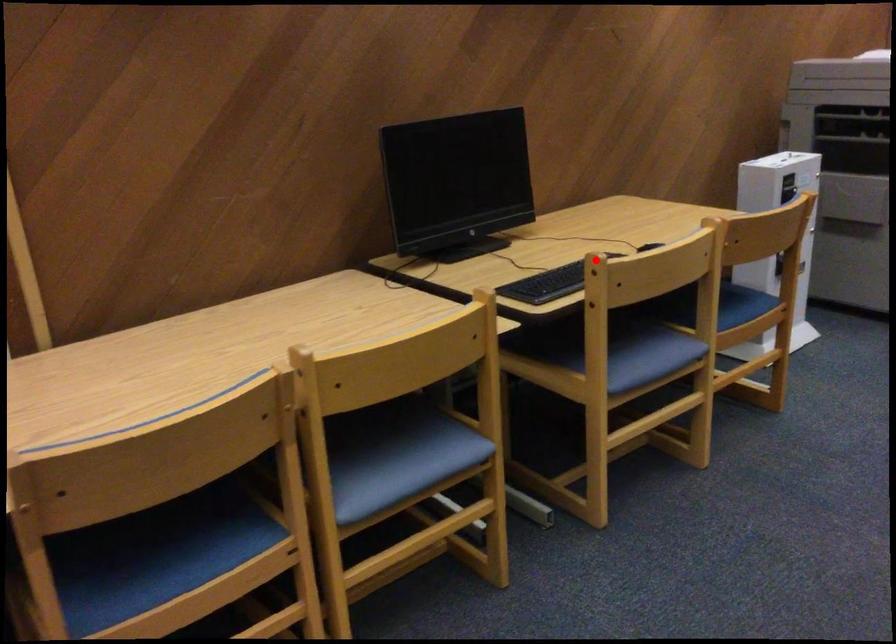
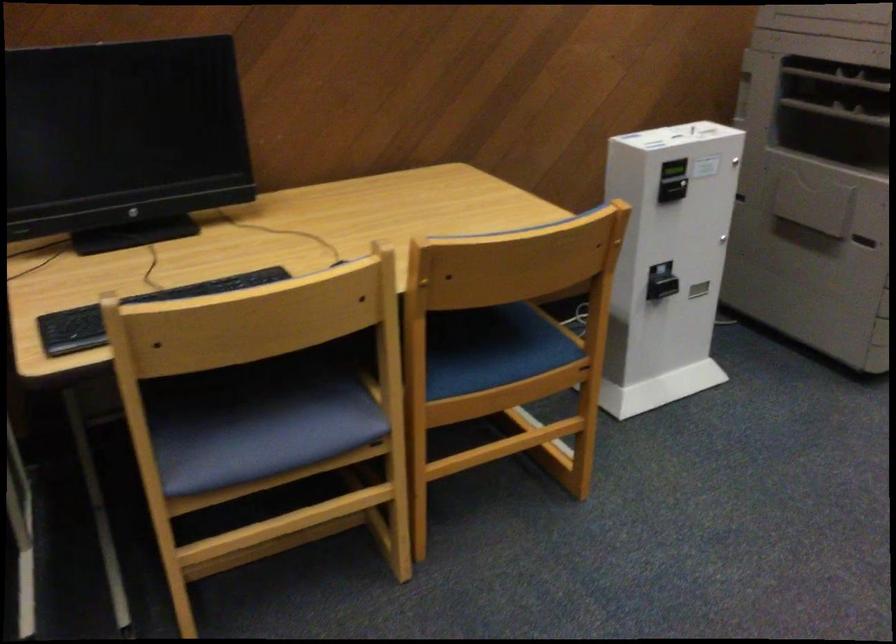
The point at the highlighted location is marked in the first image. Where is the corresponding point in the second image?

(134, 310)